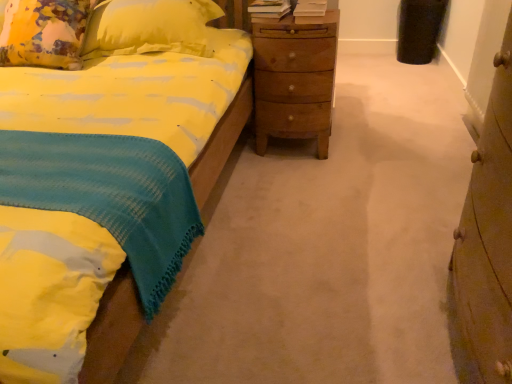
Question: Can you confirm if wooden nightstand at center is shorter than yellow fabric pillow at upper left?

Choices:
 (A) yes
 (B) no

Answer: (B)

Question: Considering the relative positions of wooden nightstand at center and yellow fabric pillow at upper left in the image provided, is wooden nightstand at center behind yellow fabric pillow at upper left?

Choices:
 (A) yes
 (B) no

Answer: (A)

Question: From a real-world perspective, is wooden nightstand at center located higher than yellow fabric pillow at upper left?

Choices:
 (A) no
 (B) yes

Answer: (A)

Question: Is wooden nightstand at center facing towards yellow fabric pillow at upper left?

Choices:
 (A) no
 (B) yes

Answer: (A)

Question: Is wooden nightstand at center directly adjacent to yellow fabric pillow at upper left?

Choices:
 (A) yes
 (B) no

Answer: (B)

Question: Is wooden chest of drawers at right bigger or smaller than yellow fabric pillow at upper left?

Choices:
 (A) small
 (B) big

Answer: (B)

Question: From the image's perspective, relative to yellow fabric pillow at upper left, is wooden chest of drawers at right above or below?

Choices:
 (A) above
 (B) below

Answer: (B)

Question: Is wooden chest of drawers at right wider or thinner than yellow fabric pillow at upper left?

Choices:
 (A) wide
 (B) thin

Answer: (B)

Question: From a real-world perspective, is wooden chest of drawers at right above or below yellow fabric pillow at upper left?

Choices:
 (A) above
 (B) below

Answer: (B)

Question: Looking at the image, does yellow fabric pillow at upper left seem bigger or smaller compared to wooden chest of drawers at right?

Choices:
 (A) big
 (B) small

Answer: (B)

Question: Visually, is yellow fabric pillow at upper left positioned to the left or to the right of wooden chest of drawers at right?

Choices:
 (A) left
 (B) right

Answer: (A)

Question: From the image's perspective, relative to wooden chest of drawers at right, is yellow fabric pillow at upper left above or below?

Choices:
 (A) above
 (B) below

Answer: (A)

Question: Looking at their shapes, would you say yellow fabric pillow at upper left is wider or thinner than wooden chest of drawers at right?

Choices:
 (A) thin
 (B) wide

Answer: (B)

Question: Does point [x=10, y=3] appear closer or farther from the camera than point [x=321, y=135]?

Choices:
 (A) farther
 (B) closer

Answer: (B)

Question: Based on their sizes in the image, would you say yellow fabric pillow at upper left is bigger or smaller than wooden nightstand at center?

Choices:
 (A) small
 (B) big

Answer: (A)